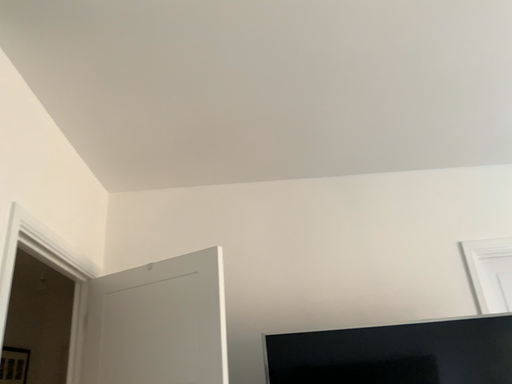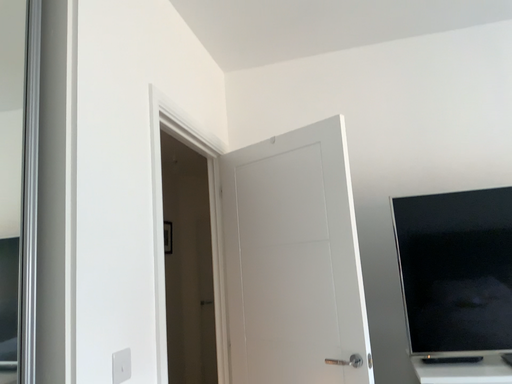
Question: How did the camera likely rotate when shooting the video?

Choices:
 (A) rotated upward
 (B) rotated downward

Answer: (B)